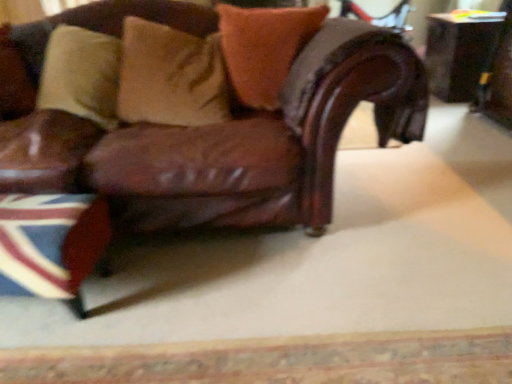
Question: From a real-world perspective, is velvet orange pillow at upper center, which is counted as the first pillow, starting from the right, positioned above or below wooden table at right?

Choices:
 (A) above
 (B) below

Answer: (A)

Question: In terms of height, does velvet orange pillow at upper center, which ranks as the third pillow in left-to-right order, look taller or shorter compared to wooden table at right?

Choices:
 (A) short
 (B) tall

Answer: (A)

Question: Estimate the real-world distances between objects in this image. Which object is closer to the brown leather chair at center?

Choices:
 (A) union jack fabric at lower left
 (B) velvet orange pillow at upper center, which is counted as the first pillow, starting from the right
 (C) brown leather pillow at upper left, the 3th pillow positioned from the right
 (D) suede-like beige pillow at upper center, positioned as the second pillow in left-to-right order
 (E) shiny black swivel chair at upper right

Answer: (B)

Question: Estimate the real-world distances between objects in this image. Which object is farther from the velvet orange pillow at upper center, which is counted as the first pillow, starting from the right?

Choices:
 (A) wooden table at right
 (B) suede-like beige pillow at upper center, which is the 2th pillow in right-to-left order
 (C) shiny black swivel chair at upper right
 (D) brown leather chair at center
 (E) brown leather pillow at upper left, the 3th pillow positioned from the right

Answer: (C)